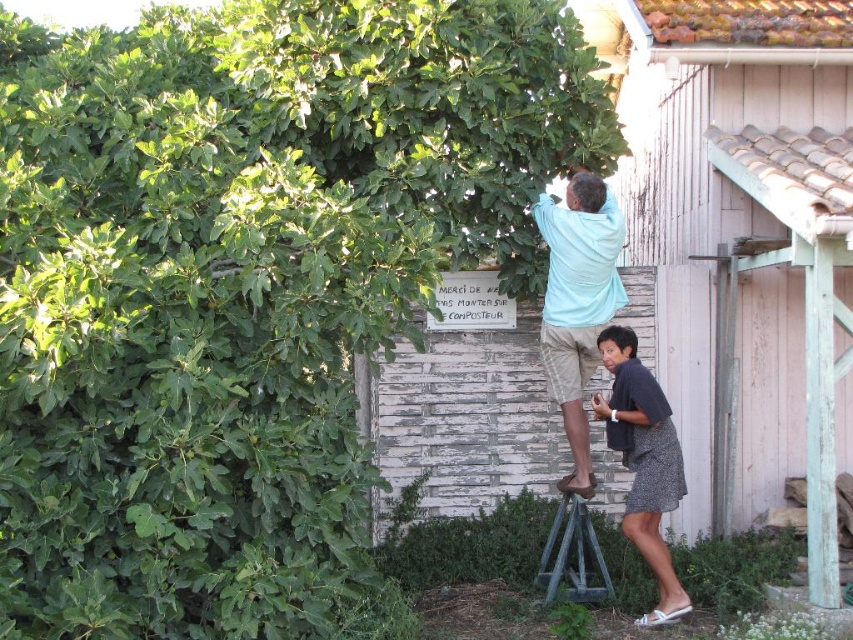
Question: Estimate the real-world distances between objects in this image. Which object is closer to the pink wood hut at upper right?

Choices:
 (A) light blue cotton shirt at upper center
 (B) dark gray textured dress at lower right

Answer: (A)

Question: Which is farther from the green leafy tree at upper left?

Choices:
 (A) pink wood hut at upper right
 (B) light blue cotton shirt at upper center
 (C) dark gray textured dress at lower right

Answer: (A)

Question: Does light blue cotton shirt at upper center have a larger size compared to dark gray textured dress at lower right?

Choices:
 (A) no
 (B) yes

Answer: (B)

Question: In this image, where is light blue cotton shirt at upper center located relative to dark gray textured dress at lower right?

Choices:
 (A) above
 (B) below

Answer: (A)

Question: Which point appears farthest from the camera in this image?

Choices:
 (A) (662, 490)
 (B) (798, 221)

Answer: (A)

Question: Is green leafy tree at upper left smaller than light blue cotton shirt at upper center?

Choices:
 (A) no
 (B) yes

Answer: (A)